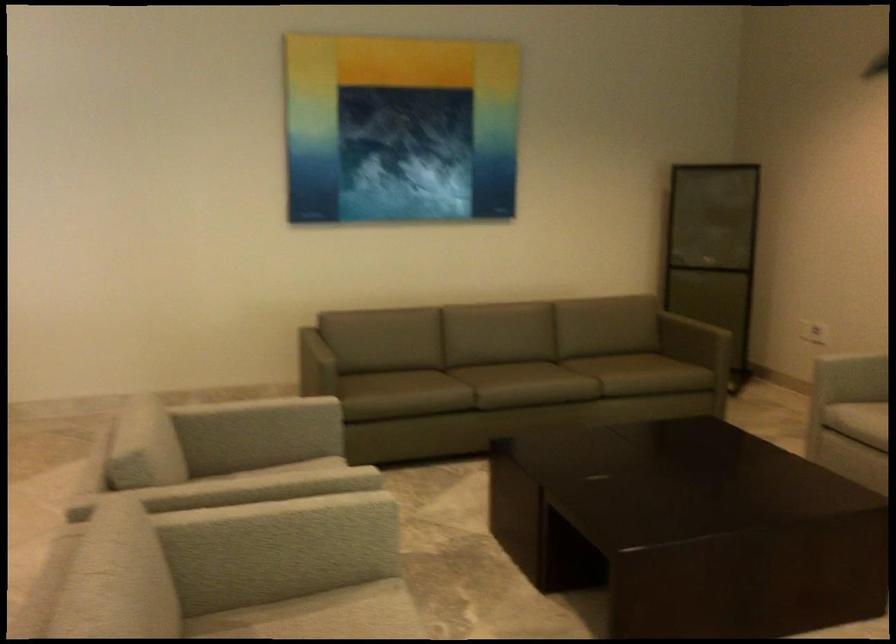
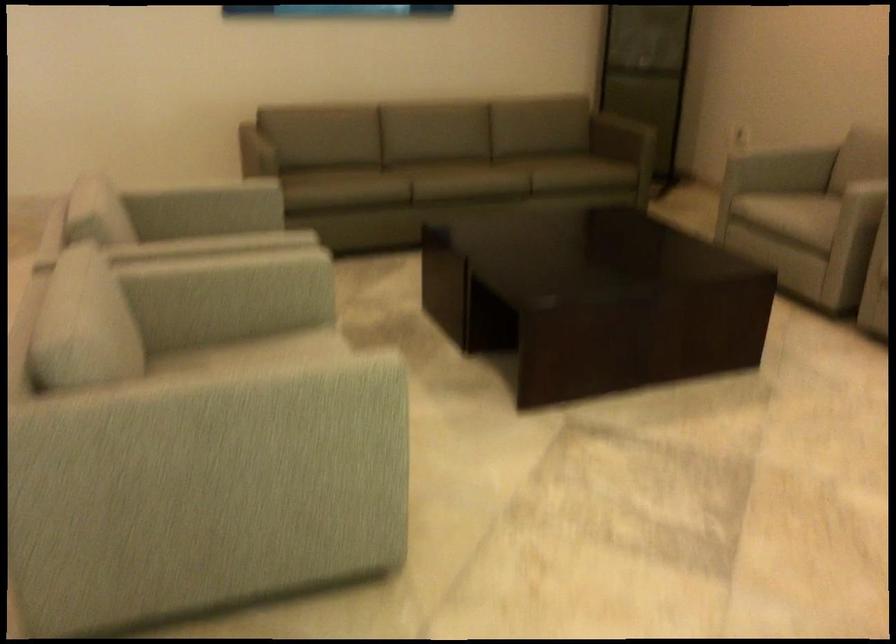
Where in the second image is the point corresponding to [228,393] from the first image?

(174, 196)